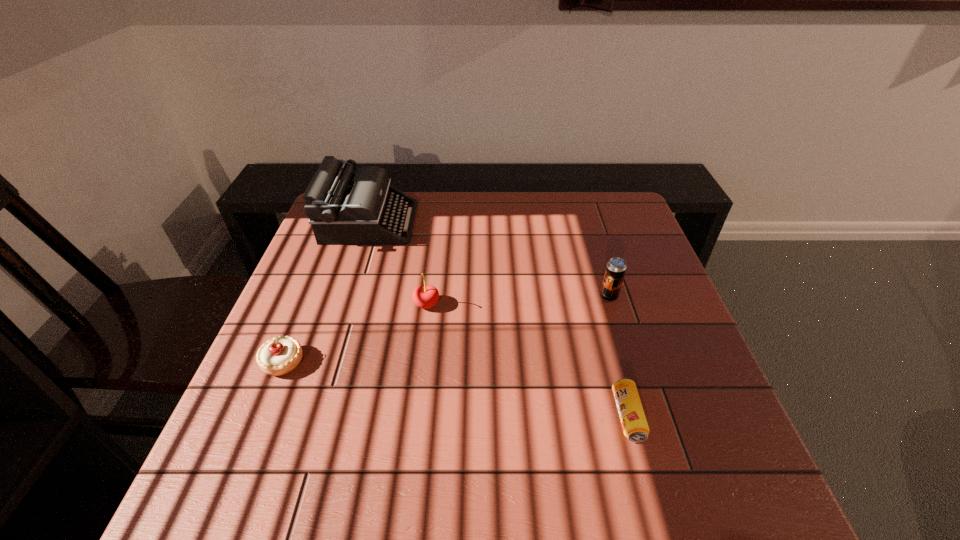
This screenshot has height=540, width=960. Identify the location of free location at the right edge. (664, 285).

In the image, there is a desktop. Where is `blank space at the near left corner`? Image resolution: width=960 pixels, height=540 pixels. blank space at the near left corner is located at coordinates (225, 477).

Find the location of a particular element. Image resolution: width=960 pixels, height=540 pixels. free space at the far right corner of the desktop is located at coordinates (619, 225).

The image size is (960, 540). In the image, there is a desktop. What are the coordinates of `vacant space at the near right corner` in the screenshot? It's located at (765, 497).

Identify the location of free space between the shorter beer can and the fourth farthest object. Image resolution: width=960 pixels, height=540 pixels. (456, 389).

You are a GUI agent. You are given a task and a screenshot of the screen. Output one action in this format:
    pyautogui.click(x=<x>, y=<y>)
    Task: Click on the free space that is in between the typewriter and the taller beer can
    The width and height of the screenshot is (960, 540).
    Given the screenshot: What is the action you would take?
    pyautogui.click(x=490, y=259)

Image resolution: width=960 pixels, height=540 pixels. In order to click on vacant area that lies between the fourth tallest object and the typewriter in this screenshot , I will do `click(326, 292)`.

Image resolution: width=960 pixels, height=540 pixels. What are the coordinates of `vacant area between the typewriter and the shortest object` in the screenshot? It's located at (498, 319).

Locate an element on the screen. Image resolution: width=960 pixels, height=540 pixels. vacant space that's between the second nearest object and the third object from left to right is located at coordinates (355, 333).

The width and height of the screenshot is (960, 540). I want to click on empty location between the farther beer can and the cherry, so click(517, 300).